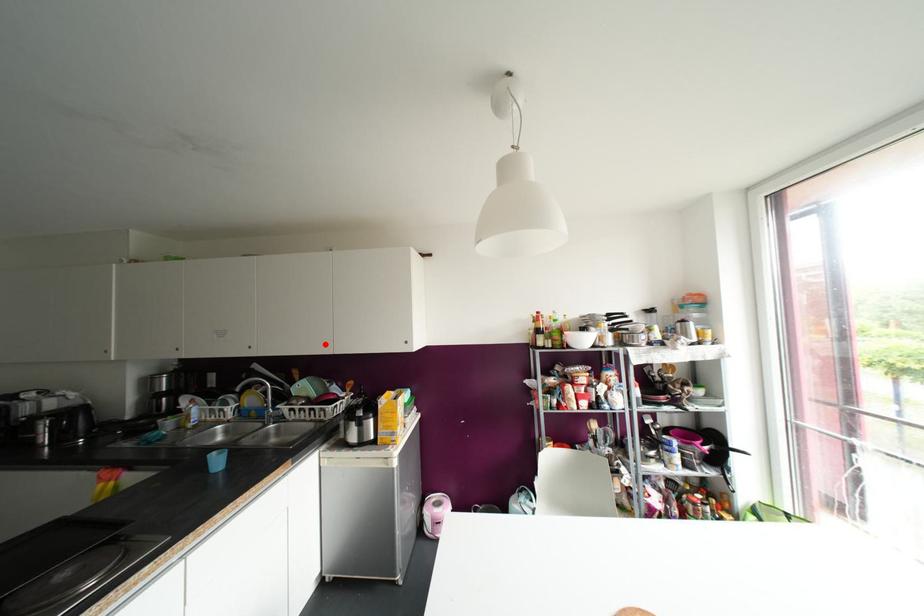
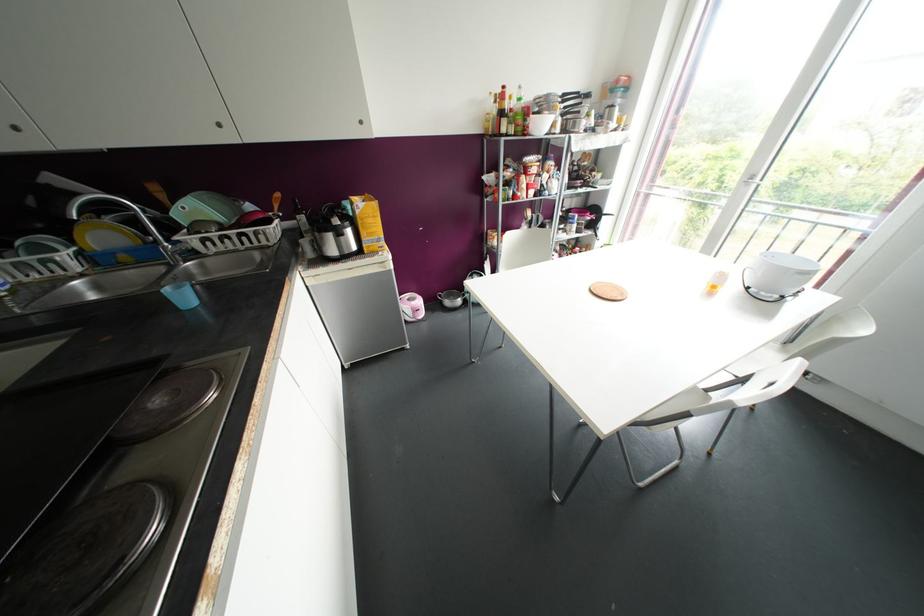
In the second image, find the point that corresponds to the highlighted location in the first image.

(219, 124)